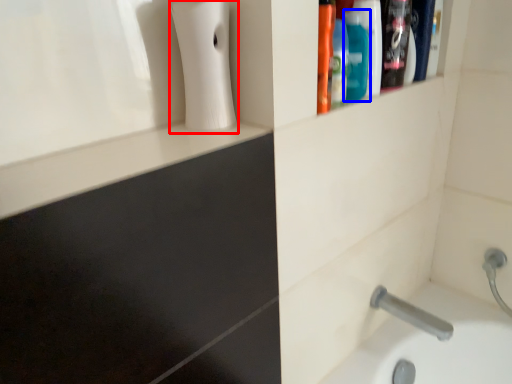
Question: Which object appears farthest to the camera in this image, soap dispenser (highlighted by a red box) or mouthwash (highlighted by a blue box)?

Choices:
 (A) soap dispenser
 (B) mouthwash

Answer: (B)